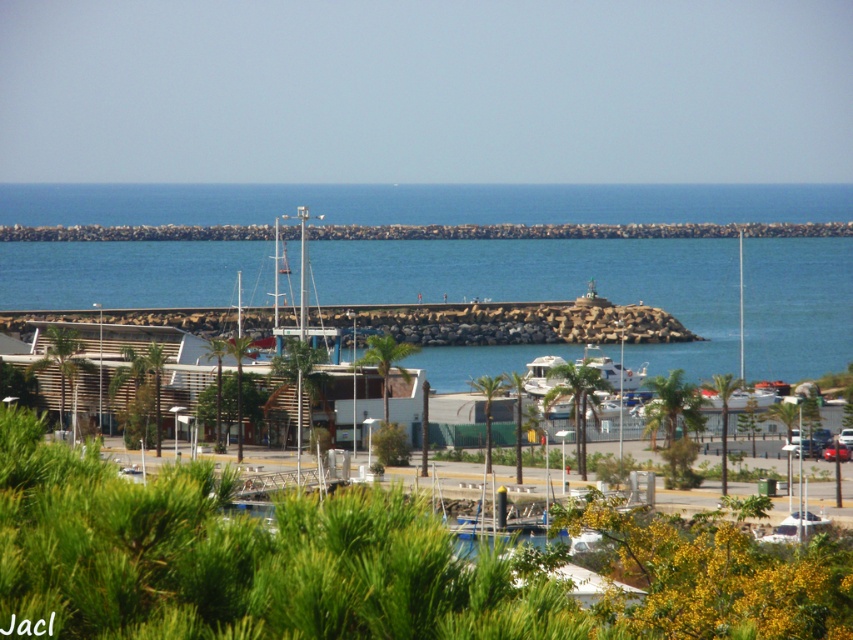
You are standing at the edge of the marina and want to throw a pebble into the blue stone water at center. Considering the distance, will the pebble reach the water?

The blue stone water at center is 162.24 meters away from the viewer. Since the average human can throw a pebble about 30 meters, the pebble will not reach the water.

Looking at this image, you are standing on the rocky jetty at center and want to reach the blue stone water at center. Which direction should you move to get there?

The blue stone water at center is in front of the rocky jetty at center, so you should move forward from the rocky jetty at center towards the blue stone water at center.

You are standing at the edge of the marina and see the blue stone water at center and the shiny red car at center. Which object is positioned to the right when looking towards the marina?

The blue stone water at center is to the right of the shiny red car at center.